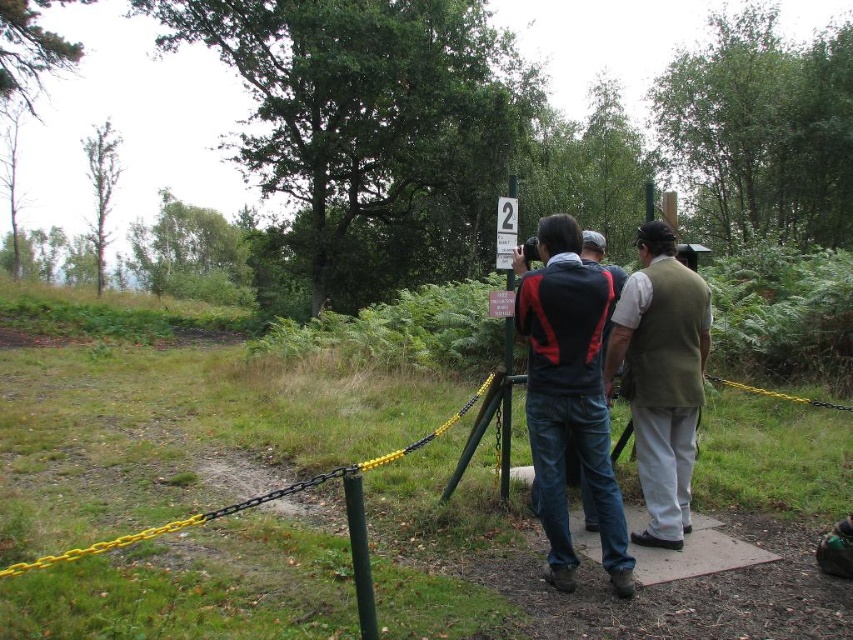
You are part of a group standing on a concrete platform in a park. You need to take a photo of the white plastic sign at center without moving closer to it. The green metallic pole at center is blocking your view. Can you move around the pole to get an unobstructed shot?

The green metallic pole at center is closer to the viewer than the white plastic sign at center, so moving around the pole could allow you to position yourself where the pole no longer blocks your view of the sign.

You are a photographer standing on a concrete platform in a park. You need to take a photo that includes both the green metallic pole at center and the white plastic sign at center. Which object should you focus on first if you want the taller object to be in sharp focus?

The green metallic pole at center is much taller than the white plastic sign at center, so you should focus on the green metallic pole at center first to ensure it is in sharp focus.

You are standing at the center of the concrete platform and want to take a photo of the khaki cotton vest at center. Where should you position yourself relative to the signpost to ensure the vest is in the frame?

The khaki cotton vest at center is located at point (660, 376), so you should position yourself facing towards the center of the platform to capture the vest in the frame.